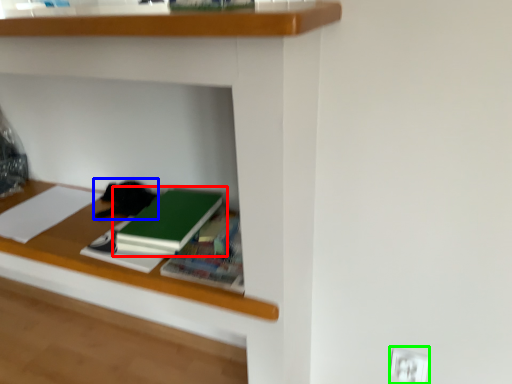
Question: Which is farther away from book (highlighted by a red box)? cat (highlighted by a blue box) or electric outlet (highlighted by a green box)?

Choices:
 (A) cat
 (B) electric outlet

Answer: (B)